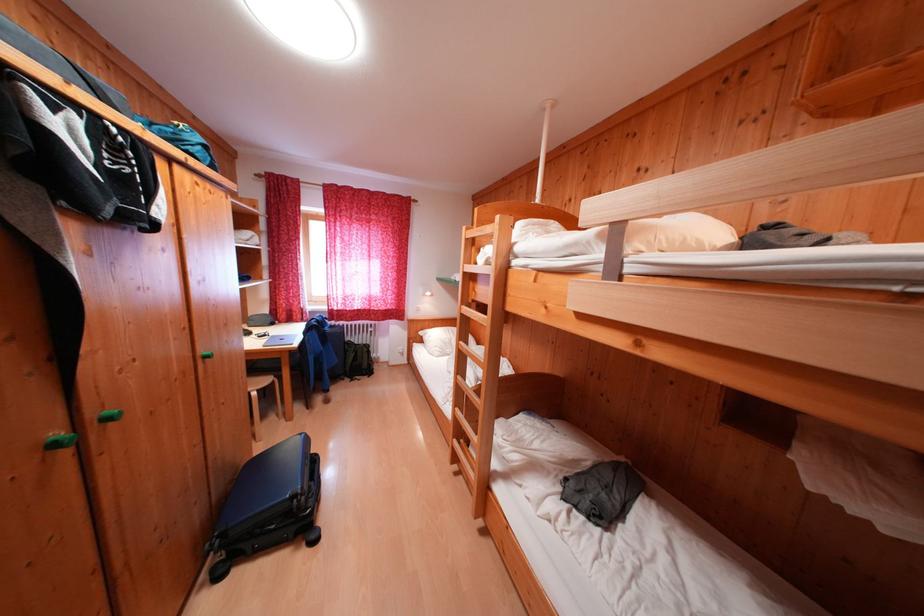
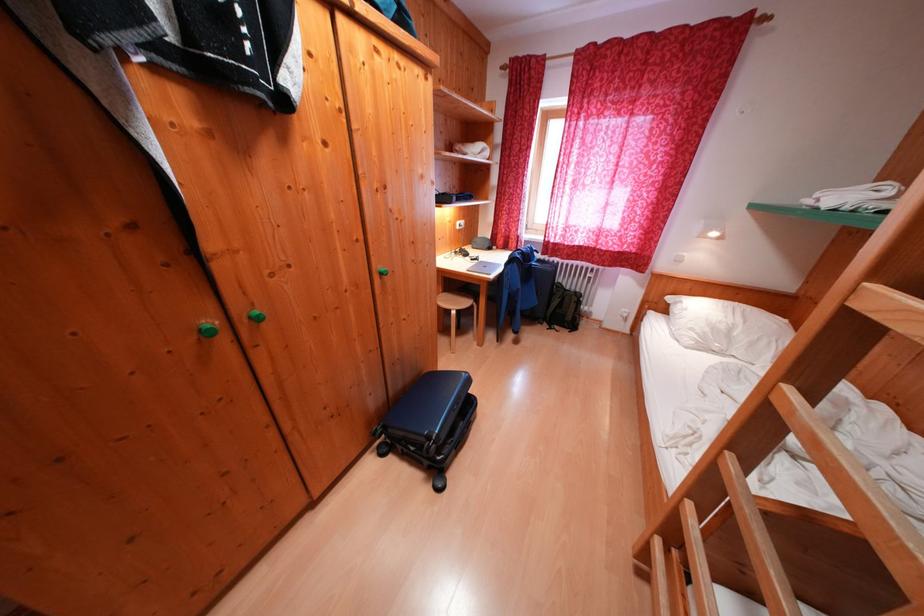
From the picture: The images are taken continuously from a first-person perspective. In which direction is your viewpoint rotating?

The rotation direction of the camera is left-down.